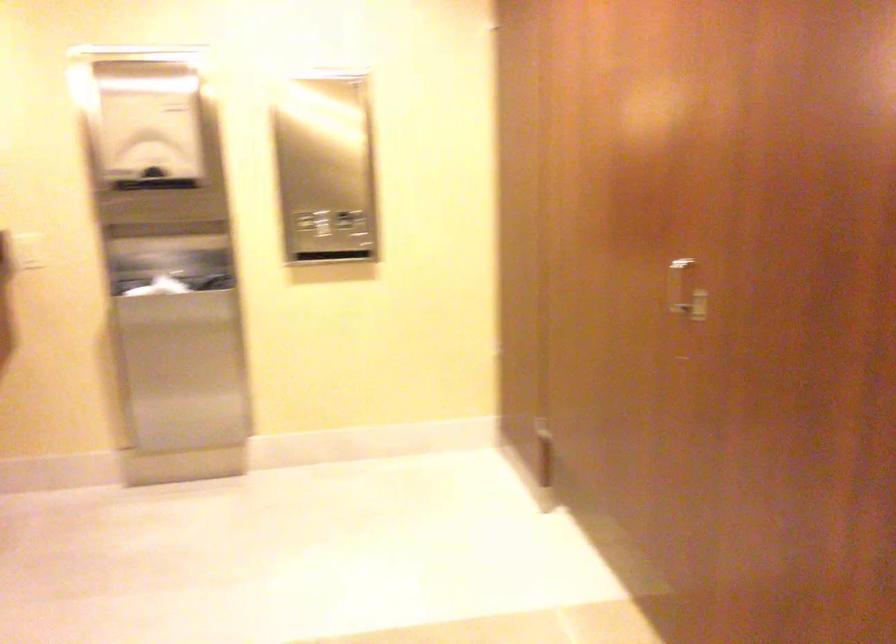
I want to click on metal door lock, so click(698, 306).